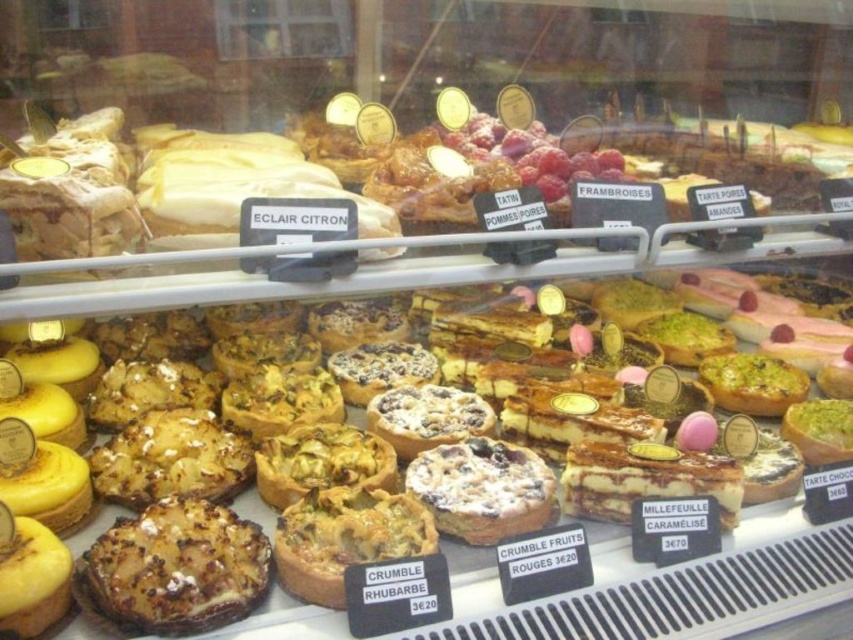
Is point (366, 548) farther from viewer compared to point (543, 467)?

No, (366, 548) is closer to viewer.

Who is more forward, (326, 602) or (515, 493)?

Point (326, 602) is more forward.

Which is behind, point (314, 602) or point (437, 499)?

The point (437, 499) is more distant.

This screenshot has width=853, height=640. Identify the location of golden flaky tartlet at center. (345, 538).

Can you confirm if golden brown flaky tart at center is smaller than crumbly brown tart at center?

No.

Based on the photo, is golden brown flaky tart at center taller than crumbly brown tart at center?

Incorrect, golden brown flaky tart at center's height is not larger of crumbly brown tart at center's.

Is point (158, 625) in front of point (469, 476)?

Yes, point (158, 625) is closer to viewer.

What are the coordinates of `golden brown flaky tart at center` in the screenshot? It's located at (175, 568).

Looking at this image, which of these two, golden flaky tartlet at center or golden brown flaky tart at lower left, stands taller?

Standing taller between the two is golden flaky tartlet at center.

Who is shorter, golden flaky tartlet at center or golden brown flaky tart at lower left?

With less height is golden brown flaky tart at lower left.

Is point (430, 522) positioned after point (13, 634)?

Yes, point (430, 522) is behind point (13, 634).

Image resolution: width=853 pixels, height=640 pixels. I want to click on golden flaky tartlet at center, so click(x=345, y=538).